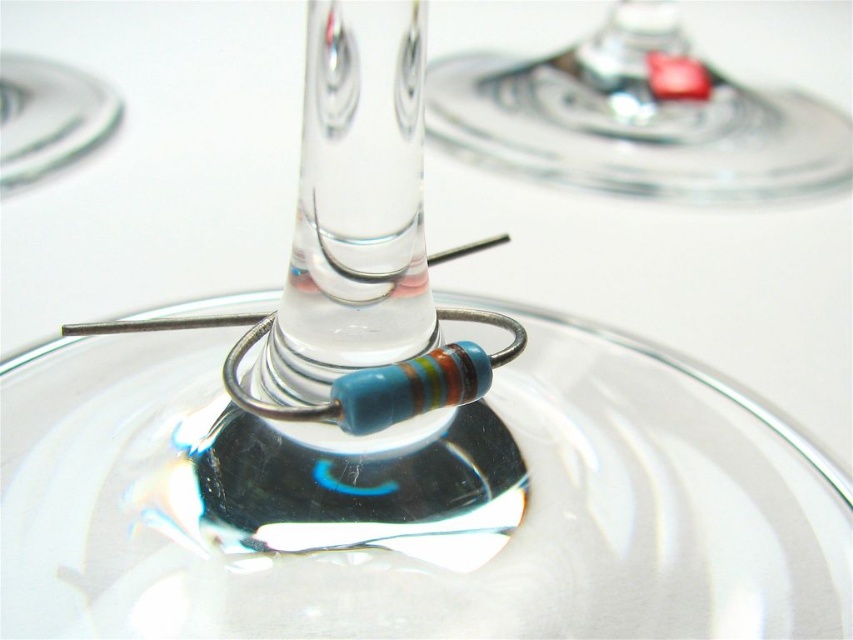
You are a photographer setting up a still life arrangement with two transparent glass objects. You notice the transparent glass at center and the transparent glass at upper center. Which glass is blocking the light from reaching the other?

The transparent glass at upper center is positioned above the transparent glass at center, so it is blocking the light from reaching the latter.

You are organizing a collection of glassware and need to place the transparent glass at center and the transparent glass at upper center into a storage box. Which one should you place first to ensure they fit properly?

The transparent glass at center should be placed first because it has a smaller size compared to the transparent glass at upper center, allowing the larger one to be placed over it without overcrowding the box.

You are a quality inspector checking a display of resistors. You notice a point at coordinates (412, 502). According to the image, what is located at that point?

The point at coordinates (412, 502) indicates the transparent glass at center.